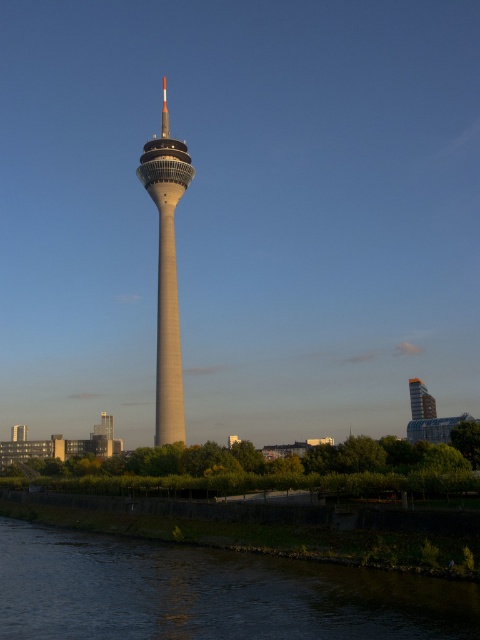
Which of these two, dark water at lower left or smooth concrete tower at center, stands shorter?

With less height is dark water at lower left.

Does dark water at lower left appear under smooth concrete tower at center?

Yes, dark water at lower left is below smooth concrete tower at center.

At what (x,y) coordinates should I click in order to perform the action: click on dark water at lower left. Please return your answer as a coordinate pair (x, y). Image resolution: width=480 pixels, height=640 pixels. Looking at the image, I should click on (210, 593).

Is smooth concrete tower at center shorter than metallic glass skyscraper at right?

No.

What do you see at coordinates (167, 273) in the screenshot? I see `smooth concrete tower at center` at bounding box center [167, 273].

Describe the element at coordinates (167, 273) in the screenshot. This screenshot has height=640, width=480. I see `smooth concrete tower at center` at that location.

The image size is (480, 640). Identify the location of smooth concrete tower at center. (167, 273).

Can you confirm if dark water at lower left is shorter than metallic glass skyscraper at right?

In fact, dark water at lower left may be taller than metallic glass skyscraper at right.

Can you confirm if dark water at lower left is positioned above metallic glass skyscraper at right?

Actually, dark water at lower left is below metallic glass skyscraper at right.

Locate an element on the screen. dark water at lower left is located at coordinates (210, 593).

Image resolution: width=480 pixels, height=640 pixels. In order to click on dark water at lower left in this screenshot , I will do `click(210, 593)`.